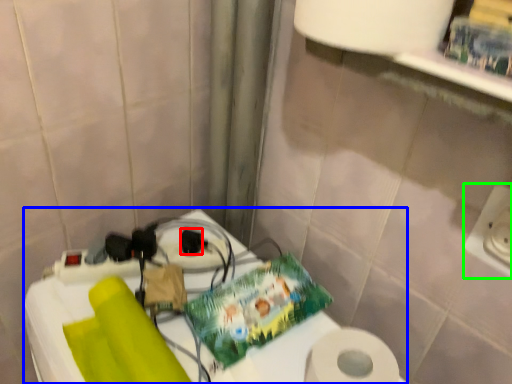
Question: Which is nearer to the socket (highlighted by a red box)? table (highlighted by a blue box) or electric outlet (highlighted by a green box).

Choices:
 (A) table
 (B) electric outlet

Answer: (A)